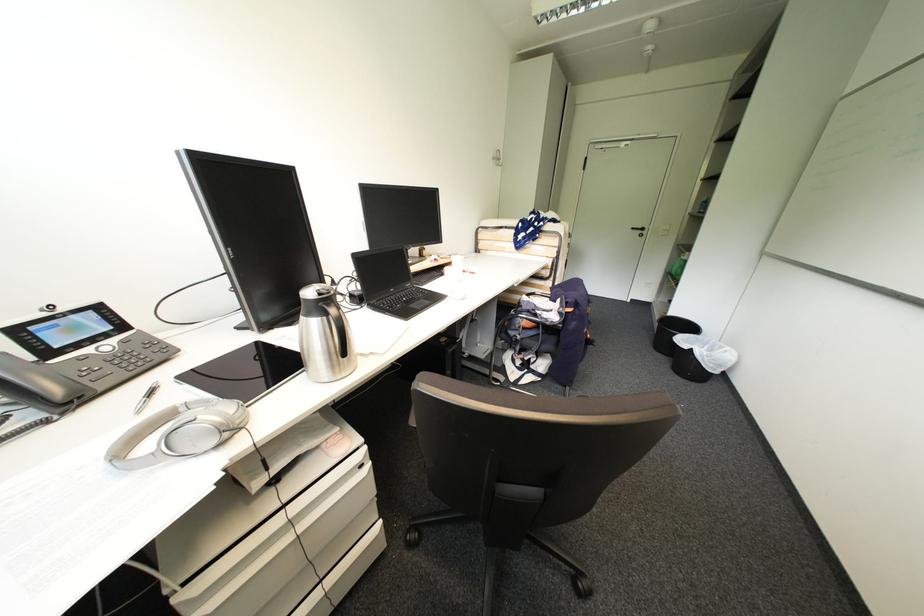
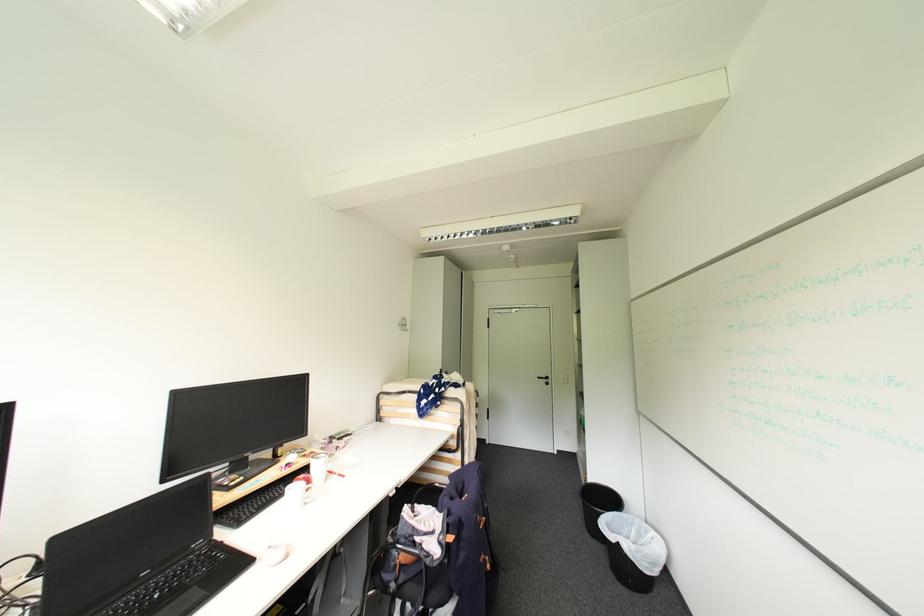
Question: I am providing you with two images of the same scene from different viewpoints. After the viewpoint changes to image2, which objects are now occluded?

Choices:
 (A) black laptop
 (B) chair sitting surface
 (C) white computer mouse
 (D) none of these

Answer: (D)